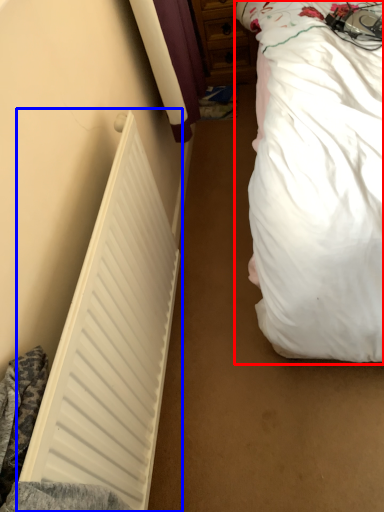
Question: Which object is closer to the camera taking this photo, bed (highlighted by a red box) or radiator (highlighted by a blue box)?

Choices:
 (A) bed
 (B) radiator

Answer: (A)